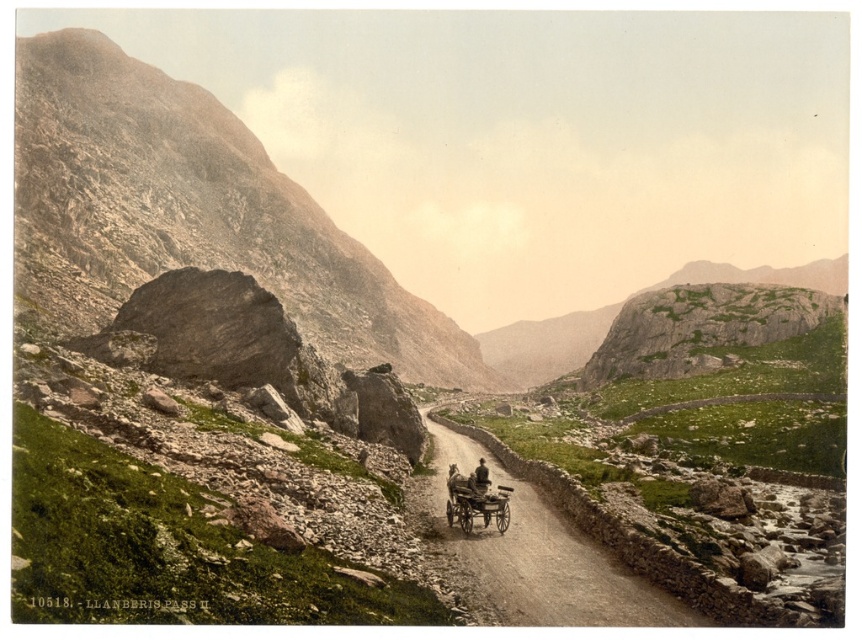
You are a photographer carrying a brown leather hat at center and standing on the brown gravel road at center. Can you comfortably walk along the road while holding the hat in one hand?

The brown gravel road at center is wider than the brown leather hat at center, so yes, you can comfortably walk along the road while holding the hat in one hand since the road provides sufficient width.

You are a geologist examining the Llanberis Pass landscape. You notice a rusty rock at left. Can you determine its exact coordinates in the image?

The rusty rock at left is located at coordinates point (192, 212).

You are a hiker carrying a 1.5 meter wide backpack. You come across the rusty rock at left and the wooden cart at center on the narrow dirt road. Can your backpack fit through the space between them?

The rusty rock at left might be wider than the wooden cart at center, so the space between them may not be wide enough for your 1.5 meter wide backpack. It is uncertain and you should check the actual width before proceeding.